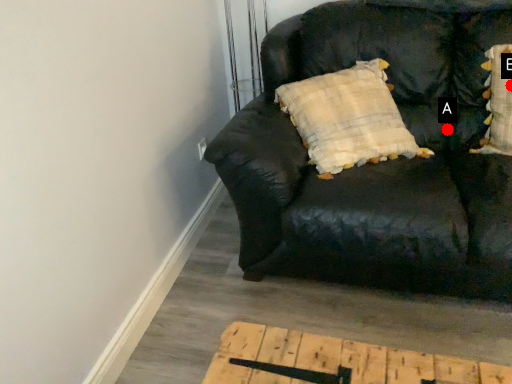
Question: Two points are circled on the image, labeled by A and B beside each circle. Which point is closer to the camera?

Choices:
 (A) A is closer
 (B) B is closer

Answer: (B)